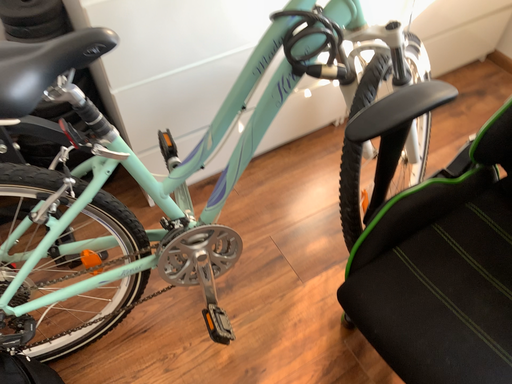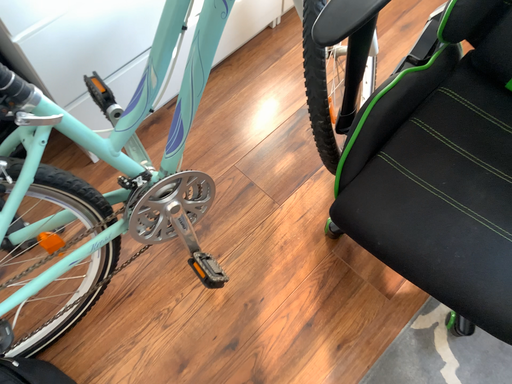
Question: Which way did the camera rotate in the video?

Choices:
 (A) rotated left
 (B) rotated right

Answer: (B)